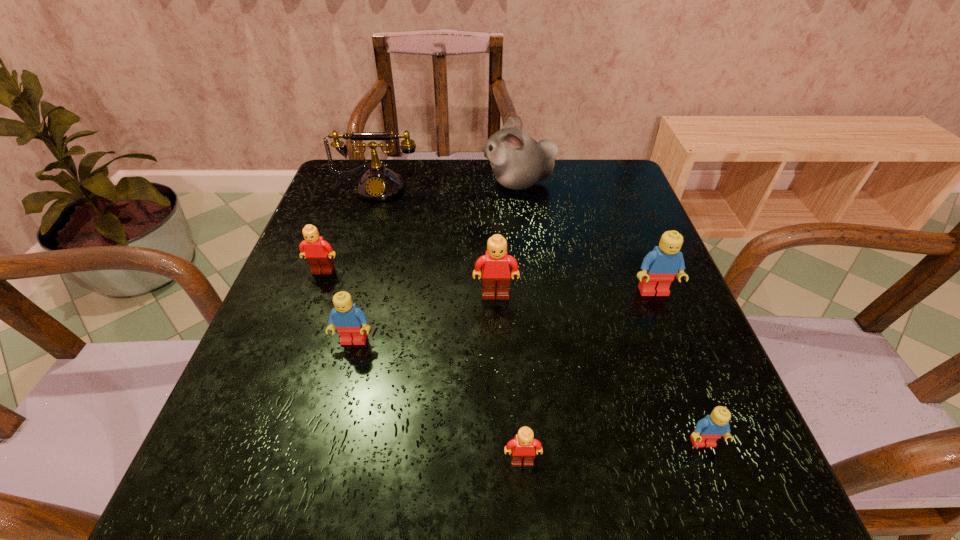
At what (x,y) coordinates should I click in order to perform the action: click on white hamster. Please return your answer as a coordinate pair (x, y). Image resolution: width=960 pixels, height=540 pixels. Looking at the image, I should click on (518, 161).

Where is `black telephone`? This screenshot has width=960, height=540. black telephone is located at coordinates (378, 184).

The width and height of the screenshot is (960, 540). I want to click on the farthest blue Lego, so click(659, 267).

This screenshot has width=960, height=540. What are the coordinates of `the biggest brown Lego` in the screenshot? It's located at (496, 260).

You are a GUI agent. You are given a task and a screenshot of the screen. Output one action in this format:
    pyautogui.click(x=<x>, y=<y>)
    Task: Click on the fifth Lego from right to left
    The width and height of the screenshot is (960, 540).
    Given the screenshot: What is the action you would take?
    pyautogui.click(x=350, y=321)

Where is `the second biggest blue Lego`? the second biggest blue Lego is located at coordinates (350, 321).

Image resolution: width=960 pixels, height=540 pixels. Find the location of `the leftmost Lego`. the leftmost Lego is located at coordinates 318,252.

Image resolution: width=960 pixels, height=540 pixels. Identify the location of the sixth nearest object. (318, 252).

The width and height of the screenshot is (960, 540). What are the coordinates of `the seventh farthest object` in the screenshot? It's located at (710, 428).

I want to click on the nearest blue Lego, so point(710,428).